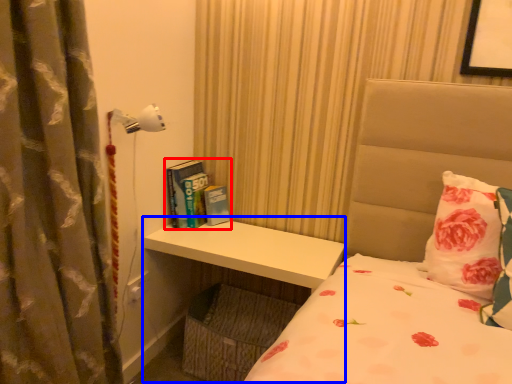
Question: Which object appears closest to the camera in this image, book (highlighted by a red box) or table (highlighted by a blue box)?

Choices:
 (A) book
 (B) table

Answer: (B)